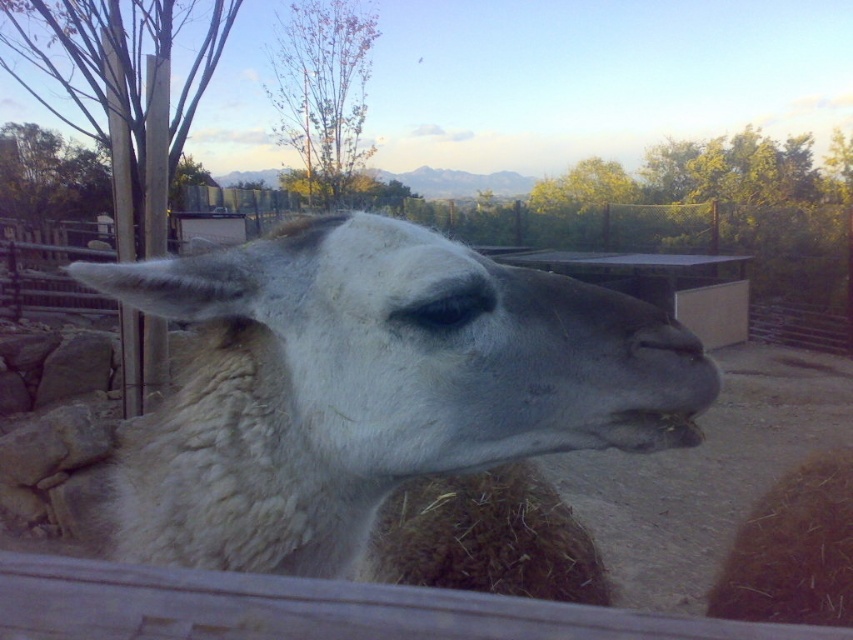
Who is more forward, (x=631, y=384) or (x=654, y=339)?

Point (x=631, y=384) is in front.

The height and width of the screenshot is (640, 853). Find the location of `white woolen alpaca at center`. white woolen alpaca at center is located at coordinates (368, 387).